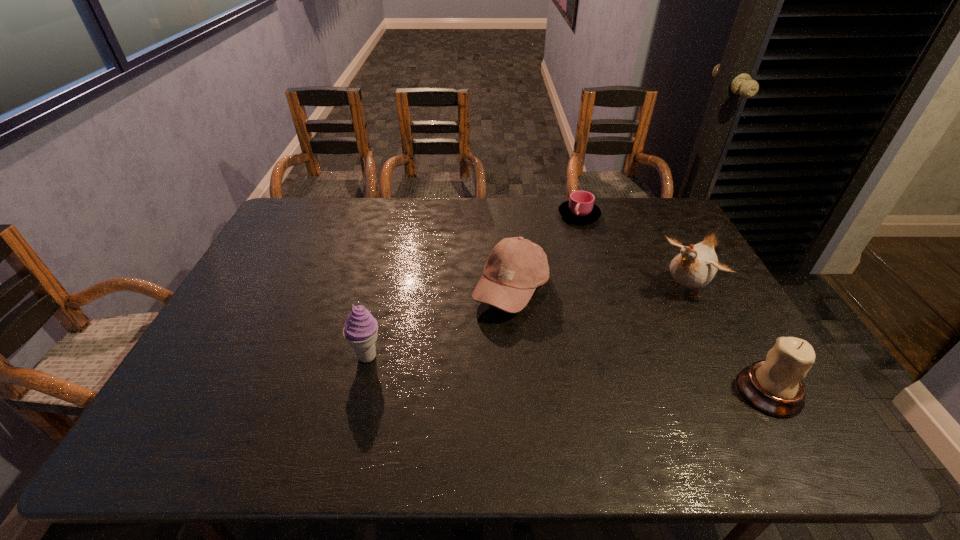
In order to click on candle holder that is at the right edge in this screenshot , I will do `click(774, 386)`.

The image size is (960, 540). What are the coordinates of `bird positioned at the right edge` in the screenshot? It's located at (695, 266).

The height and width of the screenshot is (540, 960). What are the coordinates of `object situated at the near right corner` in the screenshot? It's located at (774, 386).

Where is `vacant region at the far edge`? vacant region at the far edge is located at coordinates (558, 199).

This screenshot has width=960, height=540. What are the coordinates of `vacant region at the near edge of the desktop` in the screenshot? It's located at (501, 401).

Where is `free space at the left edge of the desktop`? Image resolution: width=960 pixels, height=540 pixels. free space at the left edge of the desktop is located at coordinates (265, 306).

I want to click on vacant space at the right edge of the desktop, so click(x=667, y=254).

In the image, there is a desktop. What are the coordinates of `free space at the far right corner` in the screenshot? It's located at (662, 210).

What are the coordinates of `free space between the leftmost object and the candle holder` in the screenshot? It's located at click(x=568, y=374).

What are the coordinates of `vacant region between the icecream and the fourth tallest object` in the screenshot? It's located at (440, 323).